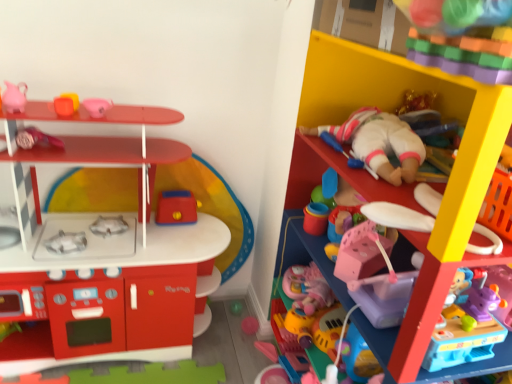
Describe the element at coordinates (462, 37) in the screenshot. Image resolution: width=512 pixels, height=384 pixels. I see `pastel plastic blocks at upper right, the ninth toy positioned from the left` at that location.

Image resolution: width=512 pixels, height=384 pixels. Identify the location of pink matte pitcher at upper left, the ninth toy positioned from the right. (14, 97).

Measure the distance between point (x=57, y=144) and camera.

Point (x=57, y=144) and camera are 1.41 meters apart from each other.

Describe the element at coordinates (398, 217) in the screenshot. This screenshot has width=512, height=384. I see `white plastic spoon at upper right, marked as the second toy in a right-to-left arrangement` at that location.

This screenshot has width=512, height=384. In order to click on pink plastic house at center, acting as the 7th toy starting from the left in this screenshot , I will do `click(310, 312)`.

I want to click on matte plastic play kitchen at left, arranged as the 6th toy when viewed from the right, so click(x=100, y=253).

Where is `pastel plastic blocks at upper right, the ninth toy positioned from the left`? pastel plastic blocks at upper right, the ninth toy positioned from the left is located at coordinates (462, 37).

Can pink matte pitcher at upper left, the ninth toy positioned from the right, be found inside rubberized red toaster at center, the fourth toy positioned from the right?

No, pink matte pitcher at upper left, the ninth toy positioned from the right, is not inside rubberized red toaster at center, the fourth toy positioned from the right.

Which of these two, rubberized red toaster at center, the fourth toy positioned from the right, or pink matte pitcher at upper left, the ninth toy positioned from the right, stands taller?

With more height is rubberized red toaster at center, the fourth toy positioned from the right.

Who is bigger, rubberized red toaster at center, the fourth toy positioned from the right, or pink matte pitcher at upper left, which is the 1th toy in left-to-right order?

rubberized red toaster at center, the fourth toy positioned from the right, is bigger.

Is rubberized red toaster at center, the sixth toy in the left-to-right sequence, turned away from pink matte pitcher at upper left, which is the 1th toy in left-to-right order?

rubberized red toaster at center, the sixth toy in the left-to-right sequence, is not turned away from pink matte pitcher at upper left, which is the 1th toy in left-to-right order.

Is pink plastic house at center, acting as the 7th toy starting from the left, turned away from matte pink hairbrush at upper left, the second toy from the left?

That's not correct — pink plastic house at center, acting as the 7th toy starting from the left, is not looking away from matte pink hairbrush at upper left, the second toy from the left.

From the image's perspective, does pink plastic house at center, acting as the 7th toy starting from the left, appear lower than matte pink hairbrush at upper left, the second toy from the left?

Yes, from the image's perspective, pink plastic house at center, acting as the 7th toy starting from the left, is below matte pink hairbrush at upper left, the second toy from the left.

Which point is more forward, (330, 304) or (33, 126)?

The point (33, 126) is in front.

Does pink plastic house at center, marked as the 3th toy in a right-to-left arrangement, have a smaller size compared to matte pink hairbrush at upper left, the second toy from the left?

No, pink plastic house at center, marked as the 3th toy in a right-to-left arrangement, is not smaller than matte pink hairbrush at upper left, the second toy from the left.

Could you tell me if matte pink hairbrush at upper left, the second toy from the left, is facing pastel plastic blocks at upper right, which ranks as the first toy in right-to-left order?

No, matte pink hairbrush at upper left, the second toy from the left, is not aimed at pastel plastic blocks at upper right, which ranks as the first toy in right-to-left order.

Are matte pink hairbrush at upper left, which appears as the 8th toy when viewed from the right, and pastel plastic blocks at upper right, the ninth toy positioned from the left, located far from each other?

Yes, matte pink hairbrush at upper left, which appears as the 8th toy when viewed from the right, and pastel plastic blocks at upper right, the ninth toy positioned from the left, are quite far apart.

Measure the distance from matte pink hairbrush at upper left, which appears as the 8th toy when viewed from the right, to pastel plastic blocks at upper right, which ranks as the first toy in right-to-left order.

matte pink hairbrush at upper left, which appears as the 8th toy when viewed from the right, and pastel plastic blocks at upper right, which ranks as the first toy in right-to-left order, are 3.91 feet apart.

From the image's perspective, count 1st toys downward from the pastel plastic blocks at upper right, which ranks as the first toy in right-to-left order, and point to it. Please provide its 2D coordinates.

[(36, 138)]

Which is more to the right, matte plastic shelf at upper right or rubber duck at upper left, the seventh toy when ordered from right to left?

Positioned to the right is matte plastic shelf at upper right.

From a real-world perspective, which object stands above the other?

rubber duck at upper left, the seventh toy when ordered from right to left, from a real-world perspective.

Who is smaller, rubberized red toaster at center, the sixth toy in the left-to-right sequence, or matte pink hairbrush at upper left, the second toy from the left?

With smaller size is matte pink hairbrush at upper left, the second toy from the left.

Between point (174, 220) and point (52, 139), which one is positioned behind?

Positioned behind is point (174, 220).

Is rubberized red toaster at center, the fourth toy positioned from the right, wider or thinner than matte pink hairbrush at upper left, which appears as the 8th toy when viewed from the right?

Clearly, rubberized red toaster at center, the fourth toy positioned from the right, has more width compared to matte pink hairbrush at upper left, which appears as the 8th toy when viewed from the right.

From a real-world perspective, is rubberized red toaster at center, the sixth toy in the left-to-right sequence, under matte pink hairbrush at upper left, which appears as the 8th toy when viewed from the right?

Yes, from a real-world perspective, rubberized red toaster at center, the sixth toy in the left-to-right sequence, is beneath matte pink hairbrush at upper left, which appears as the 8th toy when viewed from the right.

Identify the location of shelf below the matte pink hairbrush at upper left, which appears as the 8th toy when viewed from the right (from the image's perspective). (430, 183).

Is matte plastic shelf at upper right further to camera compared to matte pink hairbrush at upper left, the second toy from the left?

No, the depth of matte plastic shelf at upper right is less than that of matte pink hairbrush at upper left, the second toy from the left.

Do you think matte plastic shelf at upper right is within matte pink hairbrush at upper left, which appears as the 8th toy when viewed from the right, or outside of it?

The correct answer is: outside.

Is matte plastic shelf at upper right looking in the opposite direction of matte pink hairbrush at upper left, the second toy from the left?

matte plastic shelf at upper right does not have its back to matte pink hairbrush at upper left, the second toy from the left.

Looking at their sizes, would you say matte pink hairbrush at upper left, the second toy from the left, is wider or thinner than matte plastic play kitchen at left, the fourth toy from the left?

Considering their sizes, matte pink hairbrush at upper left, the second toy from the left, looks slimmer than matte plastic play kitchen at left, the fourth toy from the left.

Looking at this image, from the image's perspective, which is above, matte pink hairbrush at upper left, which appears as the 8th toy when viewed from the right, or matte plastic play kitchen at left, the fourth toy from the left?

From the image's view, matte pink hairbrush at upper left, which appears as the 8th toy when viewed from the right, is above.

Between matte pink hairbrush at upper left, which appears as the 8th toy when viewed from the right, and matte plastic play kitchen at left, the fourth toy from the left, which one has larger size?

matte plastic play kitchen at left, the fourth toy from the left, is bigger.

Does point (28, 130) come behind point (100, 227)?

No, (28, 130) is in front of (100, 227).

Which toy is the 4th one when counting from the back of the pink matte pitcher at upper left, which is the 1th toy in left-to-right order? Please provide its 2D coordinates.

[(176, 208)]

From the image's perspective, starting from the pink plastic house at center, marked as the 3th toy in a right-to-left arrangement, which toy is the 4th one above? Please provide its 2D coordinates.

[(36, 138)]

From the image, which object appears to be farther from matte plastic shelf at upper right, white plastic spoon at upper right, marked as the second toy in a right-to-left arrangement, or matte plastic play kitchen at left, the fourth toy from the left?

The object further to matte plastic shelf at upper right is matte plastic play kitchen at left, the fourth toy from the left.

Based on the photo, from the image, which object appears to be farther from pink matte pitcher at upper left, the ninth toy positioned from the right, rubberized red toaster at center, the fourth toy positioned from the right, or pastel plastic blocks at upper right, which ranks as the first toy in right-to-left order?

pastel plastic blocks at upper right, which ranks as the first toy in right-to-left order, lies further to pink matte pitcher at upper left, the ninth toy positioned from the right, than the other object.

Based on their spatial positions, is white plastic spoon at upper right, marked as the second toy in a right-to-left arrangement, or matte pink hairbrush at upper left, the second toy from the left, closer to rubber duck at upper left, the seventh toy when ordered from right to left?

Based on the image, matte pink hairbrush at upper left, the second toy from the left, appears to be nearer to rubber duck at upper left, the seventh toy when ordered from right to left.

Estimate the real-world distances between objects in this image. Which object is further from rubber duck at upper left, the seventh toy when ordered from right to left, rubberized red toaster at center, the sixth toy in the left-to-right sequence, or matte plastic play kitchen at left, arranged as the 6th toy when viewed from the right?

Based on the image, matte plastic play kitchen at left, arranged as the 6th toy when viewed from the right, appears to be further to rubber duck at upper left, the seventh toy when ordered from right to left.

When comparing their distances from pastel plastic blocks at upper right, which ranks as the first toy in right-to-left order, does matte plastic shelf at upper right or rubberized red toaster at center, the fourth toy positioned from the right, seem closer?

matte plastic shelf at upper right is positioned closer to the anchor pastel plastic blocks at upper right, which ranks as the first toy in right-to-left order.

Estimate the real-world distances between objects in this image. Which object is further from rubberized red toaster at center, the fourth toy positioned from the right, pink plastic house at center, marked as the 3th toy in a right-to-left arrangement, or pink matte pitcher at upper left, which is the 1th toy in left-to-right order?

The object further to rubberized red toaster at center, the fourth toy positioned from the right, is pink matte pitcher at upper left, which is the 1th toy in left-to-right order.

When comparing their distances from rubber duck at upper left, positioned as the third toy in left-to-right order, does white plastic spoon at upper right, acting as the 8th toy starting from the left, or matte plastic shelf at upper right seem closer?

matte plastic shelf at upper right is closer to rubber duck at upper left, positioned as the third toy in left-to-right order.

From the picture: Based on their spatial positions, is pastel plastic blocks at upper right, the ninth toy positioned from the left, or pink rubber duck at upper left, placed as the fifth toy when sorted from left to right, further from matte plastic play kitchen at left, arranged as the 6th toy when viewed from the right?

pastel plastic blocks at upper right, the ninth toy positioned from the left, is further to matte plastic play kitchen at left, arranged as the 6th toy when viewed from the right.

What are the coordinates of `toy positioned between pink rubber duck at upper left, acting as the 5th toy starting from the right, and rubberized red toaster at center, the fourth toy positioned from the right, from near to far` in the screenshot? It's located at (36, 138).

This screenshot has width=512, height=384. I want to click on shelf between pastel plastic blocks at upper right, which ranks as the first toy in right-to-left order, and rubberized red toaster at center, the sixth toy in the left-to-right sequence, from front to back, so click(430, 183).

Where is `toy between pink rubber duck at upper left, acting as the 5th toy starting from the right, and pink plastic house at center, marked as the 3th toy in a right-to-left arrangement, from left to right`? The image size is (512, 384). toy between pink rubber duck at upper left, acting as the 5th toy starting from the right, and pink plastic house at center, marked as the 3th toy in a right-to-left arrangement, from left to right is located at coordinates (176, 208).

Find the location of a particular element. The image size is (512, 384). toy between pink matte pitcher at upper left, which is the 1th toy in left-to-right order, and rubber duck at upper left, the seventh toy when ordered from right to left, in the horizontal direction is located at coordinates click(x=36, y=138).